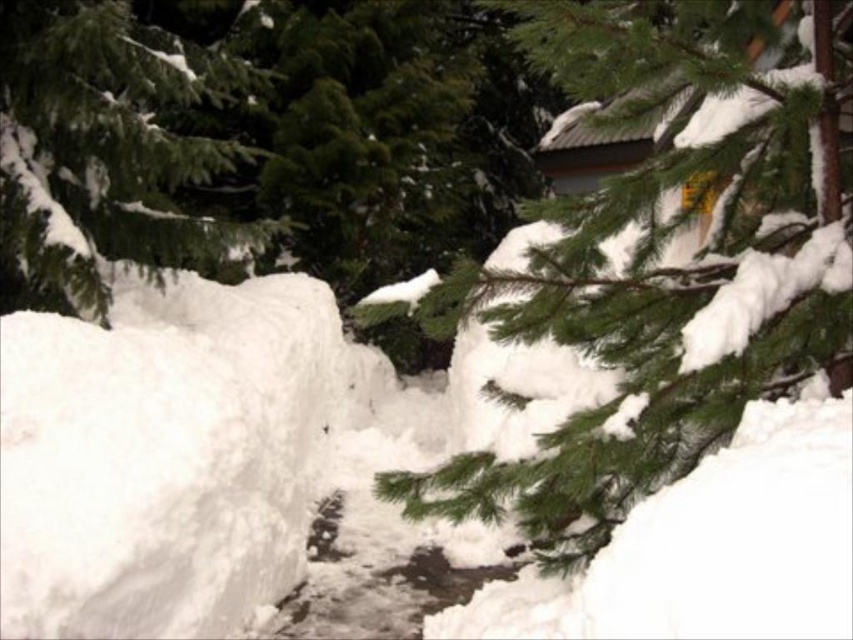
Question: Which object is positioned closest to the green matte tree branch at upper center?

Choices:
 (A) green matte tree at upper left
 (B) white fluffy snow at center

Answer: (B)

Question: Among these points, which one is farthest from the camera?

Choices:
 (A) (119, 227)
 (B) (654, 436)
 (C) (136, 316)

Answer: (A)

Question: Can you confirm if white fluffy snow at center is positioned below green matte tree at upper left?

Choices:
 (A) no
 (B) yes

Answer: (B)

Question: Can you confirm if white fluffy snow at center is smaller than green matte tree at upper left?

Choices:
 (A) no
 (B) yes

Answer: (B)

Question: Considering the real-world distances, which object is closest to the green matte tree branch at upper center?

Choices:
 (A) white fluffy snow at center
 (B) green matte tree at upper left

Answer: (A)

Question: Is white fluffy snow at center smaller than green matte tree branch at upper center?

Choices:
 (A) yes
 (B) no

Answer: (A)